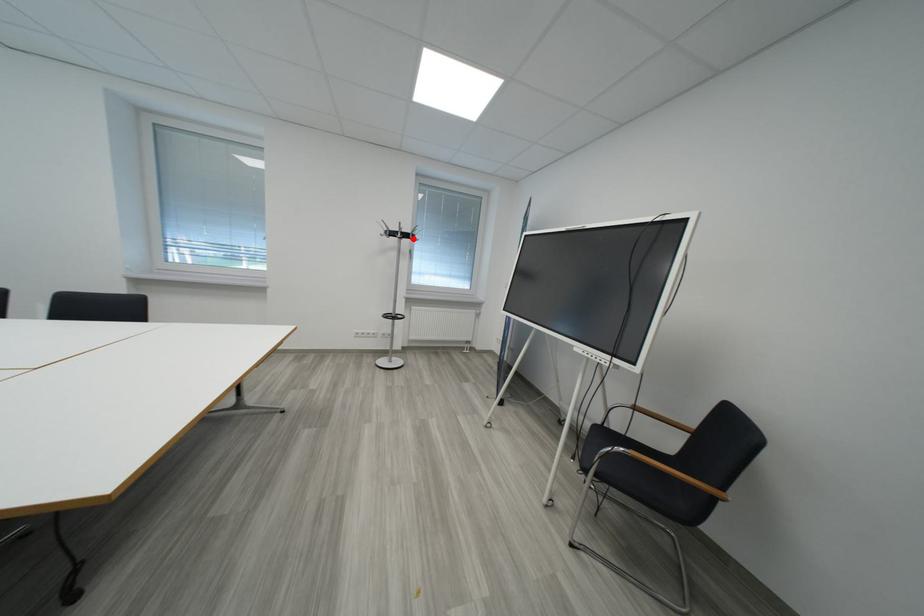
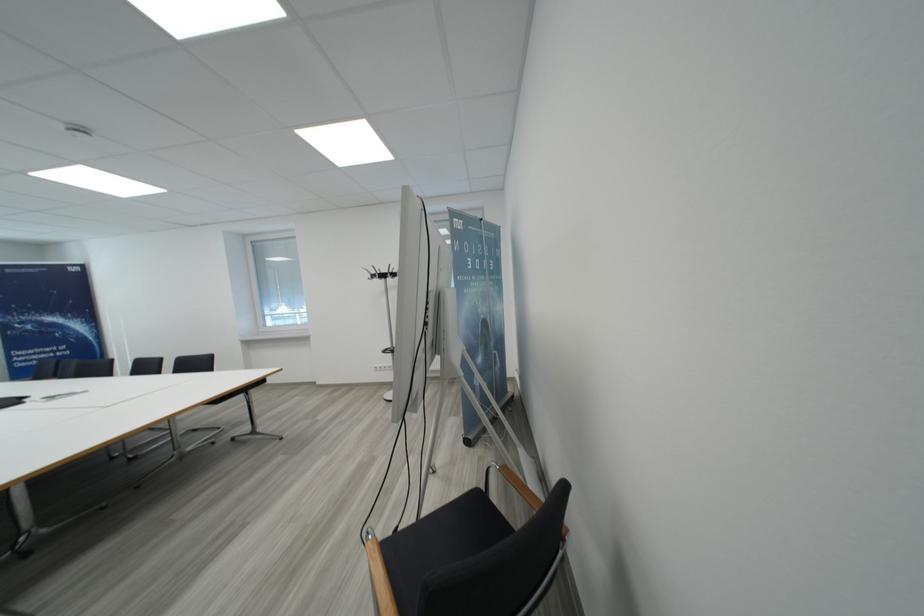
Question: I am providing you with two images of the same scene from different viewpoints. A red point is shown in image1. For the corresponding object point in image2, is it positioned nearer or farther from the camera?

Choices:
 (A) Nearer
 (B) Farther

Answer: (B)